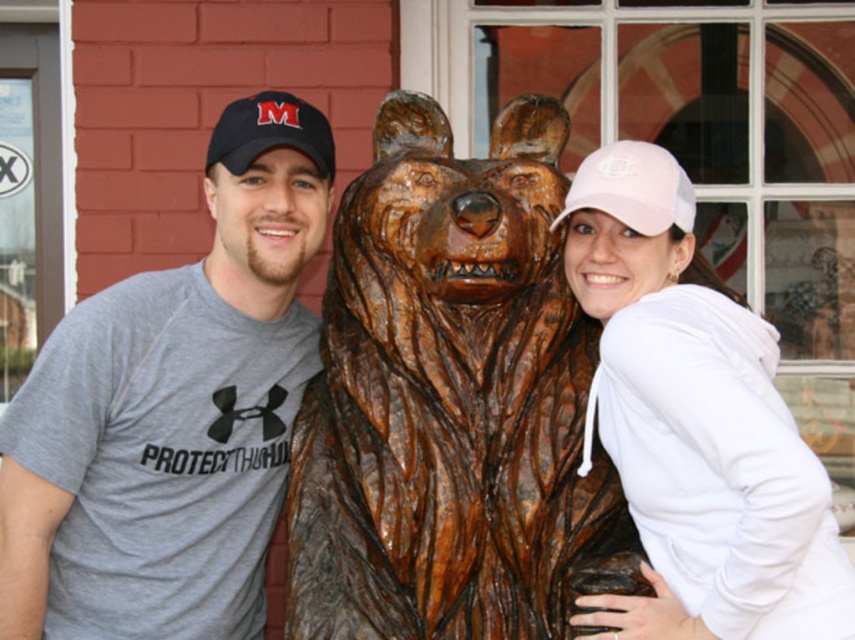
You are a photographer trying to focus on the pink mesh cap at center and the pink mesh baseball cap at upper right. Which cap is nearer to you?

The pink mesh cap at center is closer to the viewer than the pink mesh baseball cap at upper right.

You are standing in front of the bear sculpture and want to place two markers on the ground at the coordinates point (x=569, y=388) and point (x=128, y=438). Which marker will be closer to the base of the bear sculpture?

Point (x=569, y=388) is in front of point (x=128, y=438), so the marker at point (x=569, y=388) will be closer to the base of the bear sculpture.